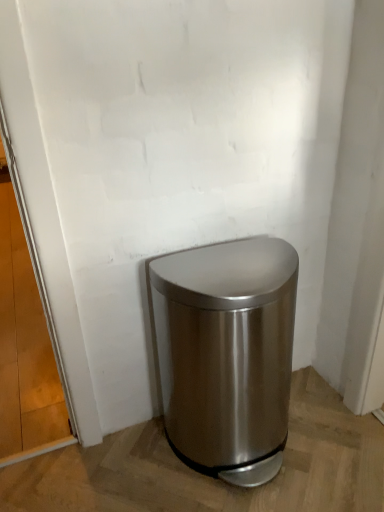
The image size is (384, 512). Identify the location of satin silver trash can at lower right. (227, 354).

Image resolution: width=384 pixels, height=512 pixels. What do you see at coordinates (227, 354) in the screenshot? I see `satin silver trash can at lower right` at bounding box center [227, 354].

Identify the location of satin silver trash can at lower right. (227, 354).